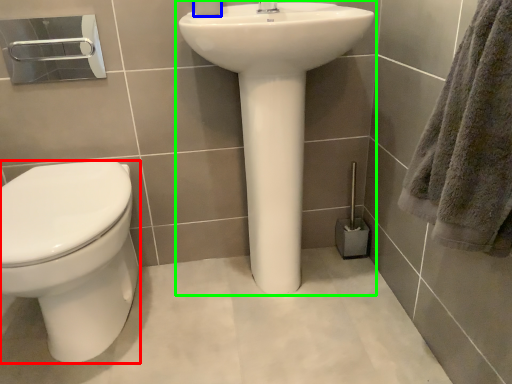
Question: Based on their relative distances, which object is farther from bidet (highlighted by a red box)? Choose from toilet paper (highlighted by a blue box) and sink (highlighted by a green box).

Choices:
 (A) toilet paper
 (B) sink

Answer: (A)